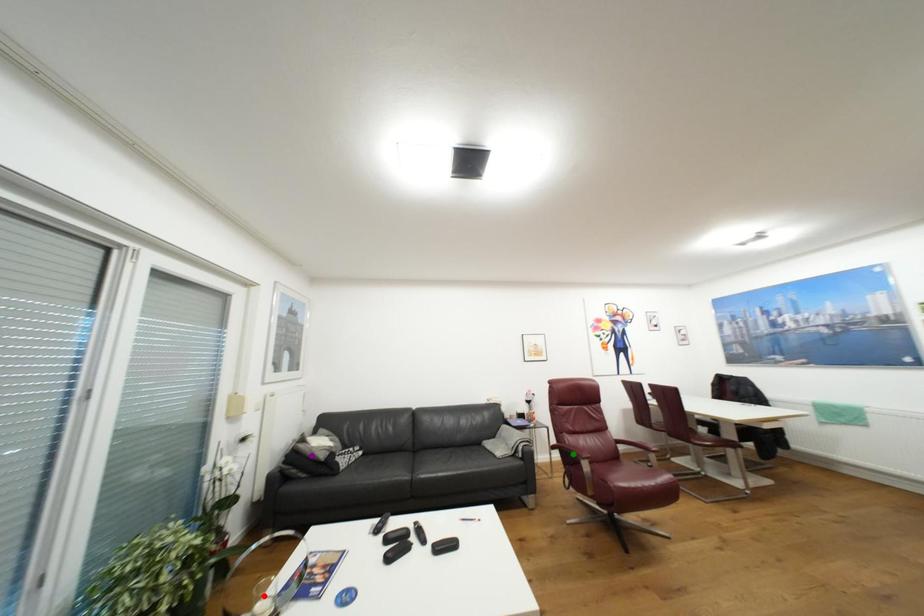
Order these from nearest to farthest:
- green point
- red point
- purple point

red point → purple point → green point